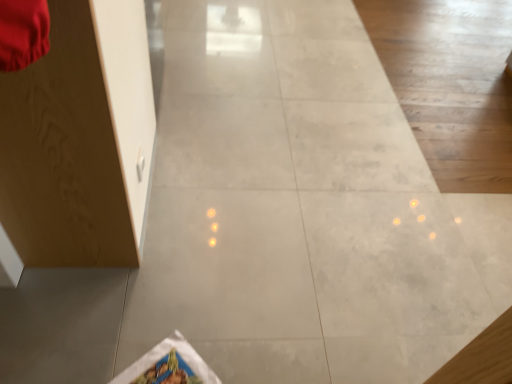
Identify the location of white glossy wrapping paper at lower center. Image resolution: width=512 pixels, height=384 pixels. (169, 365).

The image size is (512, 384). Describe the element at coordinates (169, 365) in the screenshot. I see `white glossy wrapping paper at lower center` at that location.

At what (x,y) coordinates should I click in order to perform the action: click on white glossy wrapping paper at lower center. Please return your answer as a coordinate pair (x, y). Image resolution: width=512 pixels, height=384 pixels. Looking at the image, I should click on (169, 365).